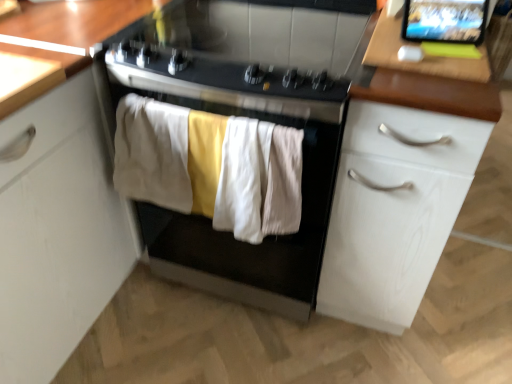
Describe the element at coordinates (394, 210) in the screenshot. I see `white wood cabinet at right` at that location.

Identify the location of black glass gas stove at center. The height and width of the screenshot is (384, 512). (251, 45).

Find the location of a particular element. beige cotton towel at center, the first clothing in the left-to-right sequence is located at coordinates (152, 153).

This screenshot has height=384, width=512. Find the location of `white cotton towel at center, placed as the 3th clothing when sorted from left to right`. white cotton towel at center, placed as the 3th clothing when sorted from left to right is located at coordinates (283, 183).

Considering the relative sizes of matte black tablet at upper right and soft cotton towels at center, which is the second clothing in right-to-left order, in the image provided, is matte black tablet at upper right shorter than soft cotton towels at center, which is the second clothing in right-to-left order,?

Yes, matte black tablet at upper right is shorter than soft cotton towels at center, which is the second clothing in right-to-left order.

Considering the relative sizes of matte black tablet at upper right and soft cotton towels at center, which is the second clothing in right-to-left order, in the image provided, is matte black tablet at upper right smaller than soft cotton towels at center, which is the second clothing in right-to-left order,?

Yes, matte black tablet at upper right is smaller than soft cotton towels at center, which is the second clothing in right-to-left order.

Does matte black tablet at upper right contain soft cotton towels at center, the 2th clothing from the left?

No, soft cotton towels at center, the 2th clothing from the left, is not surrounded by matte black tablet at upper right.

Considering the relative sizes of matte black tablet at upper right and soft cotton towels at center, the 2th clothing from the left, in the image provided, is matte black tablet at upper right thinner than soft cotton towels at center, the 2th clothing from the left,?

Indeed, matte black tablet at upper right has a lesser width compared to soft cotton towels at center, the 2th clothing from the left.

Who is more distant, soft cotton towels at center, which is the second clothing in right-to-left order, or matte black tablet at upper right?

matte black tablet at upper right is further away from the camera.

Which of these two, soft cotton towels at center, which is the second clothing in right-to-left order, or matte black tablet at upper right, is smaller?

matte black tablet at upper right is smaller.

Is soft cotton towels at center, which is the second clothing in right-to-left order, aimed at matte black tablet at upper right?

No.

Based on the photo, from a real-world perspective, does soft cotton towels at center, which is the second clothing in right-to-left order, stand above matte black tablet at upper right?

No, from a real-world perspective, soft cotton towels at center, which is the second clothing in right-to-left order, is not over matte black tablet at upper right

Is black matte oven at center aimed at beige cotton towel at center, the first clothing in the left-to-right sequence?

Yes, black matte oven at center is facing beige cotton towel at center, the first clothing in the left-to-right sequence.

Considering the relative positions of black matte oven at center and beige cotton towel at center, the first clothing in the left-to-right sequence, in the image provided, is black matte oven at center to the left of beige cotton towel at center, the first clothing in the left-to-right sequence, from the viewer's perspective?

In fact, black matte oven at center is to the right of beige cotton towel at center, the first clothing in the left-to-right sequence.

Identify the location of clothing above the black matte oven at center (from the image's perspective). (152, 153).

Who is smaller, black matte oven at center or beige cotton towel at center, the third clothing viewed from the right?

With smaller size is beige cotton towel at center, the third clothing viewed from the right.

Considering the sizes of white wood cabinet at right and beige cotton towel at center, the third clothing viewed from the right, in the image, is white wood cabinet at right wider or thinner than beige cotton towel at center, the third clothing viewed from the right,?

Considering their sizes, white wood cabinet at right looks broader than beige cotton towel at center, the third clothing viewed from the right.

Is white wood cabinet at right closer to the viewer compared to beige cotton towel at center, the third clothing viewed from the right?

Yes, white wood cabinet at right is in front of beige cotton towel at center, the third clothing viewed from the right.

Which is more to the right, white wood cabinet at right or beige cotton towel at center, the first clothing in the left-to-right sequence?

From the viewer's perspective, white wood cabinet at right appears more on the right side.

From a real-world perspective, is black glass gas stove at center above or below white cotton towel at center, placed as the 3th clothing when sorted from left to right?

black glass gas stove at center is situated higher than white cotton towel at center, placed as the 3th clothing when sorted from left to right, in the real world.

Is black glass gas stove at center next to white cotton towel at center, placed as the 3th clothing when sorted from left to right?

No.

Considering the sizes of objects black glass gas stove at center and white cotton towel at center, placed as the 3th clothing when sorted from left to right, in the image provided, who is wider, black glass gas stove at center or white cotton towel at center, placed as the 3th clothing when sorted from left to right,?

black glass gas stove at center is wider.

Is black glass gas stove at center oriented away from white cotton towel at center, the first clothing in the right-to-left sequence?

No, black glass gas stove at center is not facing the opposite direction of white cotton towel at center, the first clothing in the right-to-left sequence.

From a real-world perspective, is matte black tablet at upper right beneath black matte oven at center?

No, from a real-world perspective, matte black tablet at upper right is not beneath black matte oven at center.

Does point (440, 1) come in front of point (244, 34)?

Yes, it is in front of point (244, 34).

In the scene shown: How far apart are matte black tablet at upper right and black matte oven at center?

matte black tablet at upper right and black matte oven at center are 52.04 centimeters apart from each other.

Between matte black tablet at upper right and black matte oven at center, which one appears on the left side from the viewer's perspective?

black matte oven at center is more to the left.

Is white cotton towel at center, placed as the 3th clothing when sorted from left to right, beside wooden table at upper right?

No, white cotton towel at center, placed as the 3th clothing when sorted from left to right, is not with wooden table at upper right.

Considering the relative sizes of white cotton towel at center, placed as the 3th clothing when sorted from left to right, and wooden table at upper right in the image provided, is white cotton towel at center, placed as the 3th clothing when sorted from left to right, bigger than wooden table at upper right?

No, white cotton towel at center, placed as the 3th clothing when sorted from left to right, is not bigger than wooden table at upper right.

Consider the image. From their relative heights in the image, would you say white cotton towel at center, placed as the 3th clothing when sorted from left to right, is taller or shorter than wooden table at upper right?

Clearly, white cotton towel at center, placed as the 3th clothing when sorted from left to right, is taller compared to wooden table at upper right.

Image resolution: width=512 pixels, height=384 pixels. I want to click on computer screen above the soft cotton towels at center, which is the second clothing in right-to-left order (from the image's perspective), so click(445, 21).

Locate an element on the screen. the 3rd clothing positioned below the matte black tablet at upper right (from a real-world perspective) is located at coordinates (242, 179).

When comparing their distances from white cotton towel at center, placed as the 3th clothing when sorted from left to right, does white wood cabinet at right or matte black tablet at upper right seem closer?

Based on the image, white wood cabinet at right appears to be nearer to white cotton towel at center, placed as the 3th clothing when sorted from left to right.

Looking at the image, which one is located closer to black matte oven at center, white wood cabinet at right or white cotton towel at center, the first clothing in the right-to-left sequence?

The object closer to black matte oven at center is white wood cabinet at right.

Which object lies nearer to the anchor point black glass gas stove at center, soft cotton towels at center, which is the second clothing in right-to-left order, or black matte oven at center?

black matte oven at center lies closer to black glass gas stove at center than the other object.

Looking at this image, from the image, which object appears to be farther from wooden table at upper right, beige cotton towel at center, the first clothing in the left-to-right sequence, or black glass gas stove at center?

beige cotton towel at center, the first clothing in the left-to-right sequence, is further to wooden table at upper right.

Based on their spatial positions, is matte black tablet at upper right or white cotton towel at center, placed as the 3th clothing when sorted from left to right, further from white wood cabinet at right?

The object further to white wood cabinet at right is matte black tablet at upper right.

Based on their spatial positions, is white cotton towel at center, placed as the 3th clothing when sorted from left to right, or white wood cabinet at right further from soft cotton towels at center, the 2th clothing from the left?

white wood cabinet at right lies further to soft cotton towels at center, the 2th clothing from the left, than the other object.

Looking at this image, based on their spatial positions, is black matte oven at center or white wood cabinet at right further from wooden table at upper right?

black matte oven at center is positioned further to the anchor wooden table at upper right.

From the image, which object appears to be farther from black glass gas stove at center, wooden table at upper right or matte black tablet at upper right?

matte black tablet at upper right.

Locate an element on the screen. gas stove between soft cotton towels at center, which is the second clothing in right-to-left order, and matte black tablet at upper right is located at coordinates (251, 45).

Locate an element on the screen. The height and width of the screenshot is (384, 512). computer screen that lies between black glass gas stove at center and white cotton towel at center, the first clothing in the right-to-left sequence, from top to bottom is located at coordinates (445, 21).

Image resolution: width=512 pixels, height=384 pixels. In order to click on cabinetry between black matte oven at center and matte black tablet at upper right from left to right in this screenshot , I will do `click(394, 210)`.

Locate an element on the screen. home appliance situated between soft cotton towels at center, the 2th clothing from the left, and wooden table at upper right from left to right is located at coordinates (244, 116).